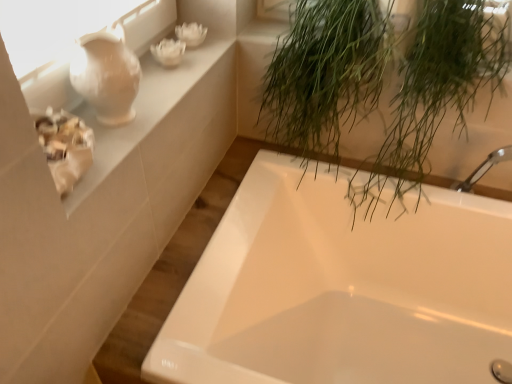
This screenshot has height=384, width=512. What do you see at coordinates (380, 82) in the screenshot?
I see `green leafy plant at upper right` at bounding box center [380, 82].

What do you see at coordinates (341, 289) in the screenshot?
I see `white glossy bathtub at center` at bounding box center [341, 289].

What are the coordinates of `white ceramic vase at upper left` in the screenshot? It's located at (144, 112).

Would you consider white ceramic vase at upper left to be distant from green leafy plant at upper right?

Actually, white ceramic vase at upper left and green leafy plant at upper right are a little close together.

Can you confirm if white ceramic vase at upper left is shorter than green leafy plant at upper right?

Correct, white ceramic vase at upper left is not as tall as green leafy plant at upper right.

Is white ceramic vase at upper left bigger than green leafy plant at upper right?

Incorrect, white ceramic vase at upper left is not larger than green leafy plant at upper right.

Is white ceramic vase at upper left facing towards green leafy plant at upper right?

No, white ceramic vase at upper left is not turned towards green leafy plant at upper right.

Is green leafy plant at upper right positioned beyond the bounds of white glossy bathtub at center?

Yes, green leafy plant at upper right is located beyond the bounds of white glossy bathtub at center.

Is green leafy plant at upper right with white glossy bathtub at center?

green leafy plant at upper right is not next to white glossy bathtub at center, and they're not touching.

From a real-world perspective, relative to white glossy bathtub at center, is green leafy plant at upper right vertically above or below?

From a real-world perspective, green leafy plant at upper right is physically above white glossy bathtub at center.

Does green leafy plant at upper right turn towards white glossy bathtub at center?

No, green leafy plant at upper right does not turn towards white glossy bathtub at center.

Can you confirm if matte white vase at upper left is shorter than green leafy plant at upper right?

Indeed, matte white vase at upper left has a lesser height compared to green leafy plant at upper right.

From the picture: Is matte white vase at upper left facing away from green leafy plant at upper right?

A: No, green leafy plant at upper right is not at the back of matte white vase at upper left.

Find the location of a particular element. houseplant behind the matte white vase at upper left is located at coordinates (380, 82).

In terms of width, does matte white vase at upper left look wider or thinner when compared to green leafy plant at upper right?

Clearly, matte white vase at upper left has less width compared to green leafy plant at upper right.

Between matte white vase at upper left and white ceramic vase at upper left, which one is positioned behind?

matte white vase at upper left is behind.

Can you confirm if matte white vase at upper left is taller than white ceramic vase at upper left?

Yes, matte white vase at upper left is taller than white ceramic vase at upper left.

From a real-world perspective, is matte white vase at upper left positioned above or below white ceramic vase at upper left?

In terms of real-world spatial position, matte white vase at upper left is above white ceramic vase at upper left.

Locate an element on the screen. The width and height of the screenshot is (512, 384). window sill above the green leafy plant at upper right (from a real-world perspective) is located at coordinates (144, 112).

Could you tell me if green leafy plant at upper right is facing white ceramic vase at upper left?

No, green leafy plant at upper right is not oriented towards white ceramic vase at upper left.

Which of these two, green leafy plant at upper right or white ceramic vase at upper left, is thinner?

With smaller width is white ceramic vase at upper left.

Who is smaller, white glossy bathtub at center or white ceramic vase at upper left?

With smaller size is white ceramic vase at upper left.

From a real-world perspective, is white glossy bathtub at center positioned above or below white ceramic vase at upper left?

In terms of real-world spatial position, white glossy bathtub at center is below white ceramic vase at upper left.

Can you see white glossy bathtub at center touching white ceramic vase at upper left?

No, white glossy bathtub at center is not in contact with white ceramic vase at upper left.

Considering the relative sizes of white glossy bathtub at center and white ceramic vase at upper left in the image provided, is white glossy bathtub at center wider than white ceramic vase at upper left?

Indeed, white glossy bathtub at center has a greater width compared to white ceramic vase at upper left.

Which of these two, matte white vase at upper left or white glossy bathtub at center, stands taller?

white glossy bathtub at center is taller.

Looking at their sizes, would you say matte white vase at upper left is wider or thinner than white glossy bathtub at center?

Clearly, matte white vase at upper left has less width compared to white glossy bathtub at center.

Which is more to the right, matte white vase at upper left or white glossy bathtub at center?

white glossy bathtub at center is more to the right.

From the image's perspective, is matte white vase at upper left beneath white glossy bathtub at center?

No, from the image's perspective, matte white vase at upper left is not below white glossy bathtub at center.

Locate an element on the screen. Image resolution: width=512 pixels, height=384 pixels. houseplant located above the white ceramic vase at upper left (from the image's perspective) is located at coordinates (380, 82).

The height and width of the screenshot is (384, 512). In order to click on houseplant above the white glossy bathtub at center (from a real-world perspective) in this screenshot , I will do `click(380, 82)`.

When comparing their distances from green leafy plant at upper right, does white ceramic vase at upper left or matte white vase at upper left seem further?

Based on the image, matte white vase at upper left appears to be further to green leafy plant at upper right.

Based on the photo, considering their positions, is matte white vase at upper left positioned further to white ceramic vase at upper left than white glossy bathtub at center?

The object further to white ceramic vase at upper left is white glossy bathtub at center.

Estimate the real-world distances between objects in this image. Which object is further from white glossy bathtub at center, green leafy plant at upper right or matte white vase at upper left?

Among the two, matte white vase at upper left is located further to white glossy bathtub at center.

Based on the photo, from the image, which object appears to be nearer to white glossy bathtub at center, white ceramic vase at upper left or matte white vase at upper left?

The object closer to white glossy bathtub at center is white ceramic vase at upper left.

Considering their positions, is matte white vase at upper left positioned closer to green leafy plant at upper right than white glossy bathtub at center?

Among the two, white glossy bathtub at center is located nearer to green leafy plant at upper right.

Estimate the real-world distances between objects in this image. Which object is further from white glossy bathtub at center, white ceramic vase at upper left or green leafy plant at upper right?

white ceramic vase at upper left is further to white glossy bathtub at center.

When comparing their distances from white ceramic vase at upper left, does white glossy bathtub at center or green leafy plant at upper right seem closer?

Based on the image, green leafy plant at upper right appears to be nearer to white ceramic vase at upper left.

Considering their positions, is white glossy bathtub at center positioned closer to matte white vase at upper left than green leafy plant at upper right?

Based on the image, green leafy plant at upper right appears to be nearer to matte white vase at upper left.

The image size is (512, 384). I want to click on glass vase that lies between green leafy plant at upper right and white glossy bathtub at center from top to bottom, so click(106, 74).

Find the location of `window sill between green leafy plant at upper right and white glossy bathtub at center from top to bottom`. window sill between green leafy plant at upper right and white glossy bathtub at center from top to bottom is located at coordinates (144, 112).

This screenshot has width=512, height=384. I want to click on glass vase between white ceramic vase at upper left and white glossy bathtub at center vertically, so click(106, 74).

Locate an element on the screen. window sill situated between matte white vase at upper left and green leafy plant at upper right from left to right is located at coordinates (x=144, y=112).